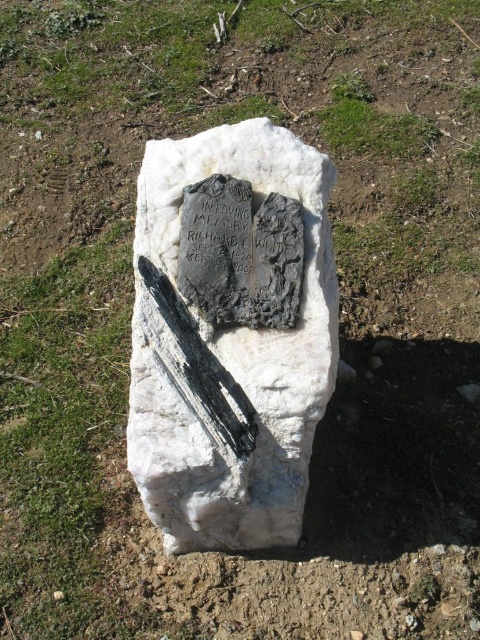
You are standing in front of a memorial marker. You see a white marble stone at center and a black polished blade at center. Which object is placed on top of the other?

The white marble stone at center is positioned over the black polished blade at center.

You are standing in front of the memorial marker described in the scene. There is a specific point marked at coordinates (230, 353). What object is located at this point?

The point at coordinates (230, 353) indicates the white marble stone at center.